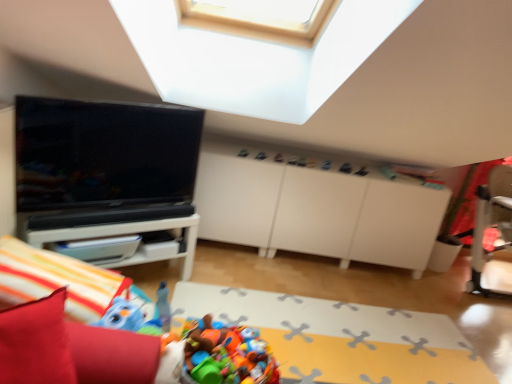
At what (x,y) coordinates should I click in order to perform the action: click on vacant space behind matte plastic toy at upper center, placed as the 2th toy when sorted from right to left. Please return your answer as a coordinate pair (x, y). The height and width of the screenshot is (384, 512). Looking at the image, I should click on (283, 150).